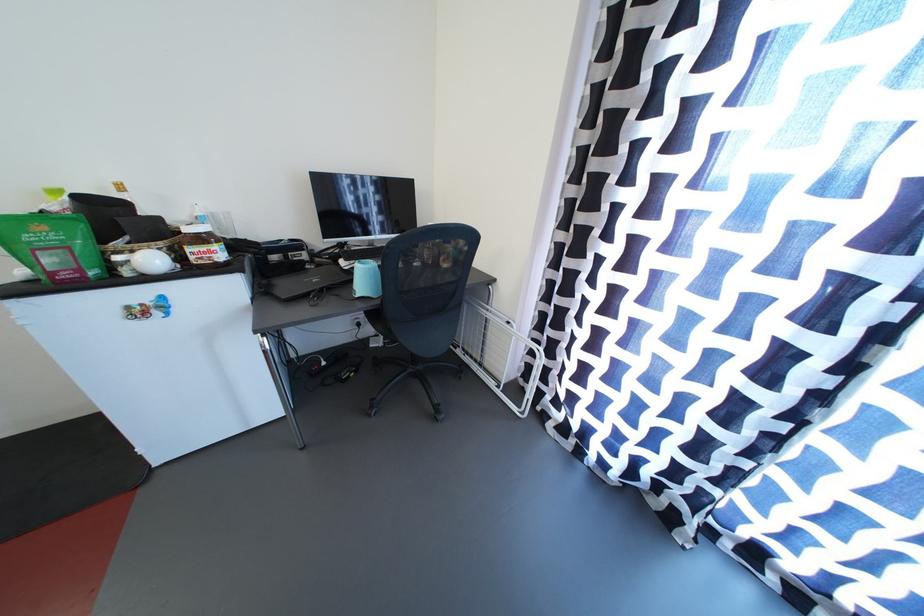
Which object does [148,246] point to?

This point indicates the wicker basket.